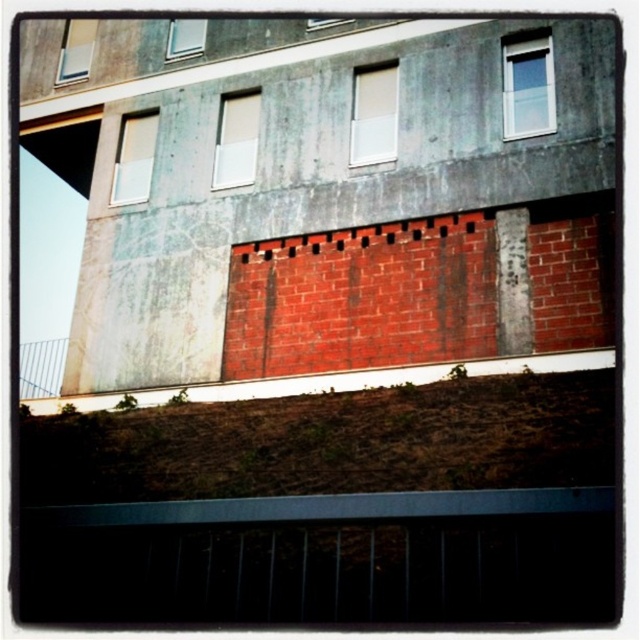
In the scene shown: You are standing at the base of the building and want to place a 10 meter long banner between the brown grass at lower center and the matte white window at center. Will the banner fit without overlapping either object?

The distance between the brown grass at lower center and the matte white window at center is 13.58 meters. Since the banner is 10 meters long, it will fit between them without overlapping either object as there is sufficient space.

You are standing 5 meters away from the base of the building. If you want to reach the brown grass at lower center, how much further do you need to walk forward?

The brown grass at lower center is 6.88 meters away from the camera. Since you are already 5 meters away from the base of the building, you need to walk an additional 1.88 meters forward to reach it.